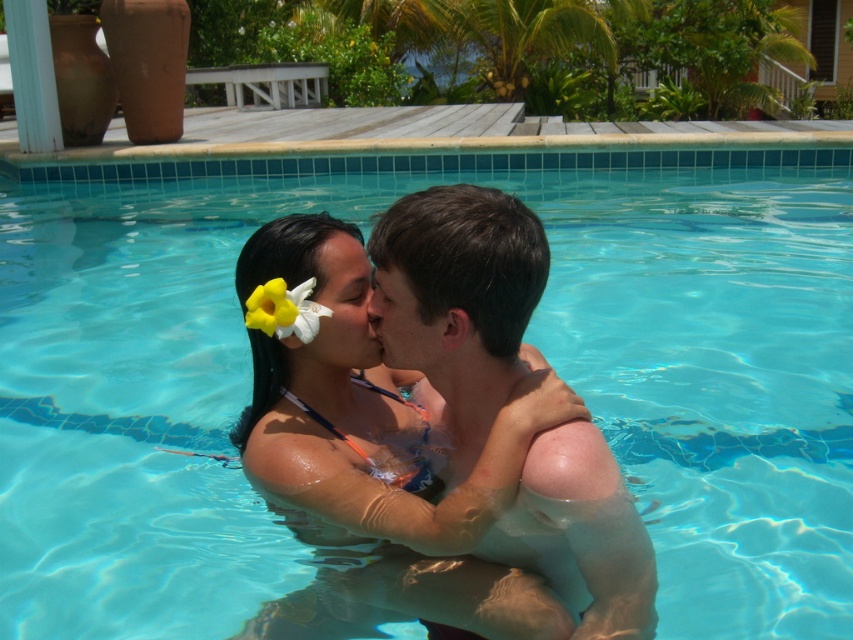
Question: Can you confirm if yellow matte flower at upper center is smaller than smooth skin nose at center?

Choices:
 (A) no
 (B) yes

Answer: (A)

Question: Which object is the farthest from the smooth skin man at center?

Choices:
 (A) yellow matte flower at upper center
 (B) smooth skin nose at center

Answer: (A)

Question: Which point is closer to the camera?

Choices:
 (A) smooth skin nose at center
 (B) smooth skin man at center

Answer: (B)

Question: Which point appears farthest from the camera in this image?

Choices:
 (A) (383, 298)
 (B) (293, 324)

Answer: (B)

Question: Is yellow matte flower at upper center bigger than smooth skin nose at center?

Choices:
 (A) yes
 (B) no

Answer: (A)

Question: Considering the relative positions of smooth skin man at center and smooth skin nose at center in the image provided, where is smooth skin man at center located with respect to smooth skin nose at center?

Choices:
 (A) below
 (B) above

Answer: (A)